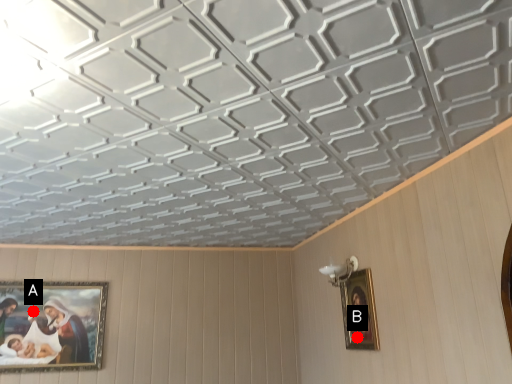
Question: Two points are circled on the image, labeled by A and B beside each circle. Which of the following is the closest to the observer?

Choices:
 (A) A is closer
 (B) B is closer

Answer: (B)